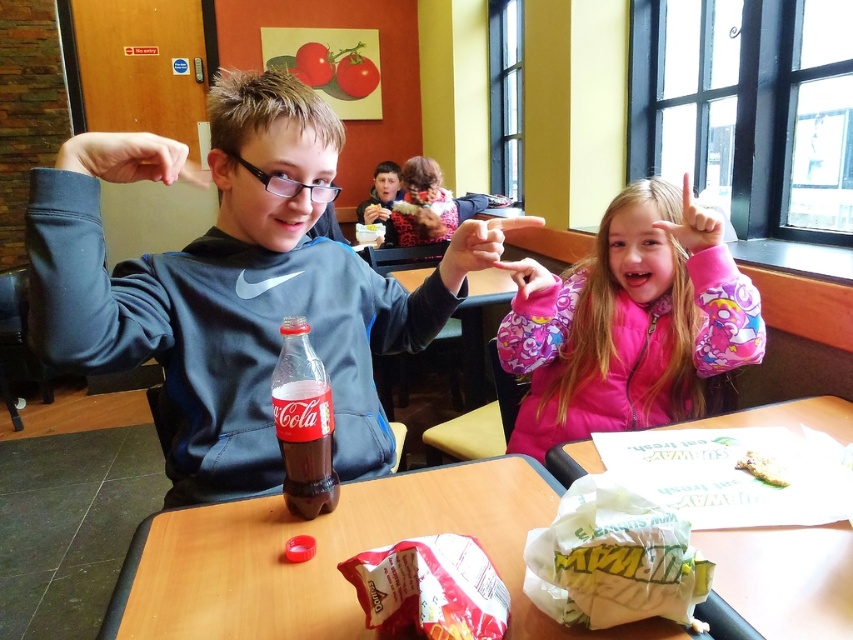
You are a delivery person who just arrived at the restaurant. You need to place a large pizza box on the table without it hanging over the edge. Considering the wooden table at center and the white paper bag at table right, which object determines the maximum width the pizza box can be to fit on the table?

The wooden table at center determines the maximum width the pizza box can be to fit on the table since its width surpasses the white paper bag at table right, meaning the table itself is wider than the bag. However, the pizza box must not exceed the table width to avoid hanging over the edge.

You are a waiter in a restaurant and need to deliver a drink to the customer sitting at the table. The table has a pink fleece jacket at center and a matte red bag at table center. Which object should you avoid placing the drink near to prevent spills?

You should avoid placing the drink near the pink fleece jacket at center because it is positioned on the right side of the matte red bag at table center, meaning it is closer to where the customer might reach, increasing the risk of spills.